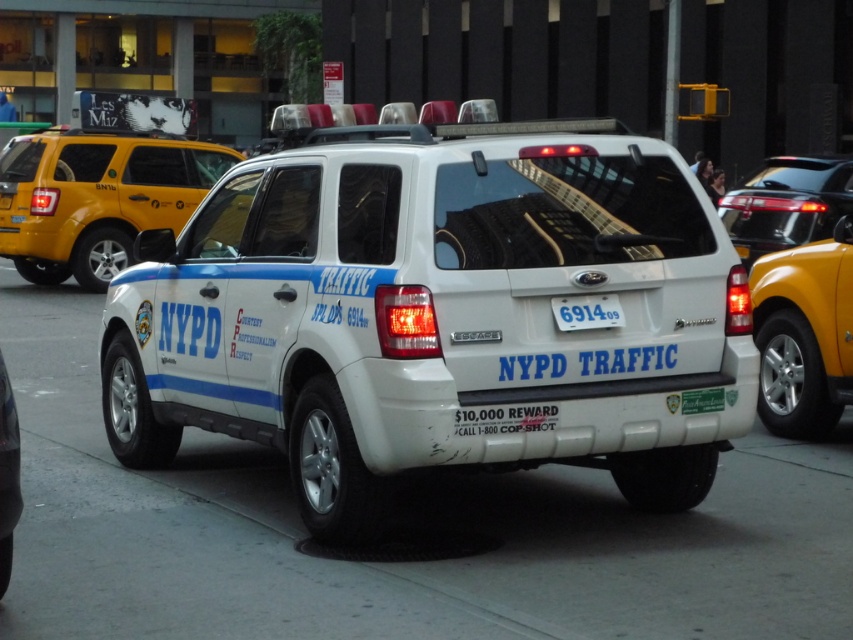
How far apart are white asphalt pavement at center and shiny black sedan at right?

white asphalt pavement at center is 16.59 feet away from shiny black sedan at right.

Is point (128, 474) farther from viewer compared to point (799, 198)?

No, it is not.

The image size is (853, 640). I want to click on white asphalt pavement at center, so click(399, 531).

Which is below, white glossy suv at center or white plastic license plate at center?

white glossy suv at center is lower down.

Is white glossy suv at center smaller than white plastic license plate at center?

Incorrect, white glossy suv at center is not smaller in size than white plastic license plate at center.

Locate an element on the screen. This screenshot has height=640, width=853. white glossy suv at center is located at coordinates point(438,316).

Does white asphalt pavement at center come in front of white plastic license plate at center?

Yes, it is in front of white plastic license plate at center.

Is white asphalt pavement at center wider than white plastic license plate at center?

Yes.

Where is `white asphalt pavement at center`? This screenshot has width=853, height=640. white asphalt pavement at center is located at coordinates (399, 531).

The image size is (853, 640). Find the location of `white asphalt pavement at center`. white asphalt pavement at center is located at coordinates (399, 531).